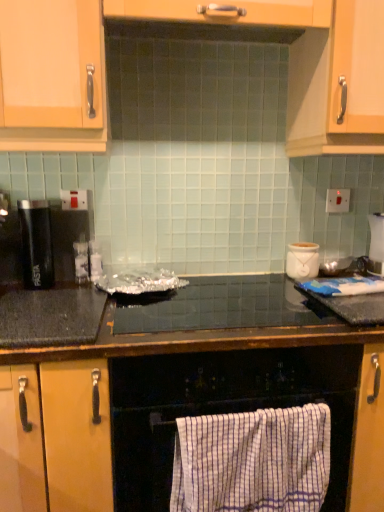
Where is `vacant space situated on the left part of white ceramic pot at upper right`? The height and width of the screenshot is (512, 384). vacant space situated on the left part of white ceramic pot at upper right is located at coordinates click(261, 280).